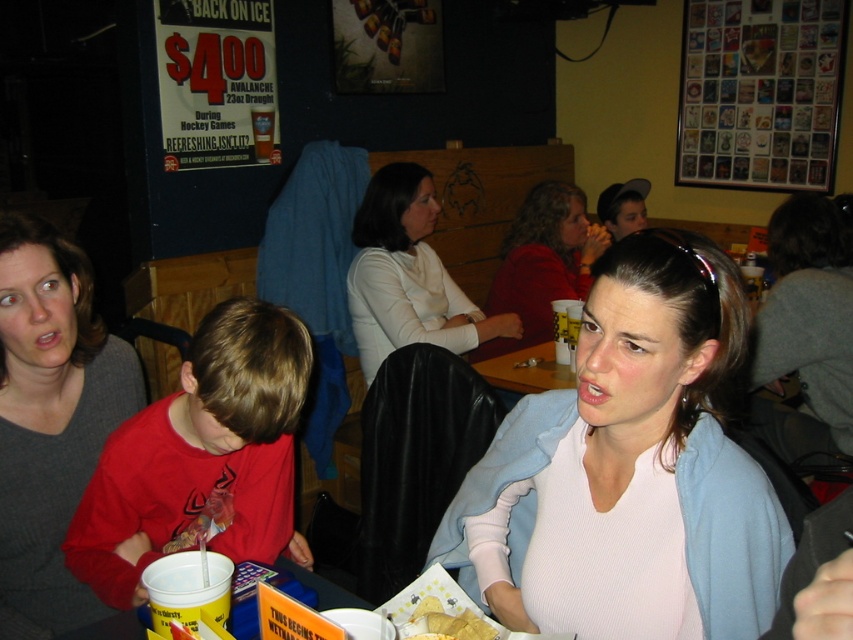
Does point (737, 460) lie behind point (517, 349)?

No.

Is point (704, 536) positioned in front of point (549, 380)?

That is True.

Find the location of a particular element. The height and width of the screenshot is (640, 853). white ribbed sweater at center is located at coordinates (647, 432).

The image size is (853, 640). Identify the location of white ribbed sweater at center. (647, 432).

Does white ribbed sweater at center have a smaller size compared to white matte shirt at center?

Correct, white ribbed sweater at center occupies less space than white matte shirt at center.

Is white ribbed sweater at center taller than white matte shirt at center?

No.

What do you see at coordinates (647, 432) in the screenshot?
I see `white ribbed sweater at center` at bounding box center [647, 432].

Find the location of a particular element. white ribbed sweater at center is located at coordinates (647, 432).

Can you confirm if white matte shirt at center is positioned to the left of wooden table at center?

Indeed, white matte shirt at center is positioned on the left side of wooden table at center.

Where is `white matte shirt at center`? This screenshot has height=640, width=853. white matte shirt at center is located at coordinates (408, 275).

Does point (355, 214) come farther from viewer compared to point (523, 358)?

Yes, point (355, 214) is farther from viewer.

At what (x,y) coordinates should I click in order to perform the action: click on white matte shirt at center. Please return your answer as a coordinate pair (x, y). The image size is (853, 640). Looking at the image, I should click on (408, 275).